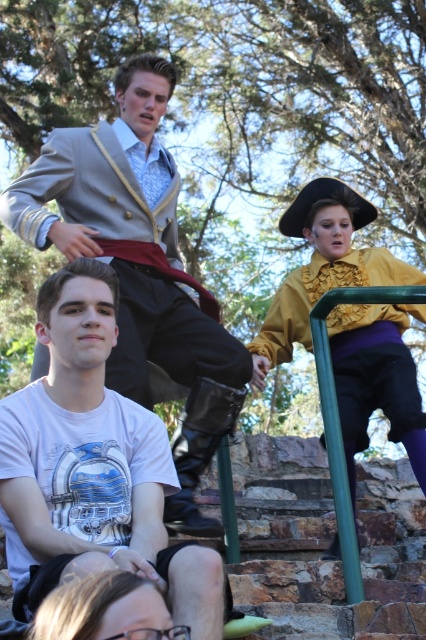
Between point (132, 97) and point (348, 243), which one is positioned behind?

The point (348, 243) is more distant.

Between matte gray suit at upper left and matte yellow blouse at upper right, which one is positioned higher?

Positioned higher is matte gray suit at upper left.

Does point (157, 193) come closer to viewer compared to point (282, 308)?

That is True.

At what (x,y) coordinates should I click in order to perform the action: click on matte gray suit at upper left. Please return your answer as a coordinate pair (x, y). Looking at the image, I should click on (140, 268).

Is point (58, 419) closer to camera compared to point (51, 157)?

That is True.

Which is more to the right, white cotton t-shirt at lower left or matte gray suit at upper left?

Positioned to the right is white cotton t-shirt at lower left.

This screenshot has height=640, width=426. Describe the element at coordinates (92, 467) in the screenshot. I see `white cotton t-shirt at lower left` at that location.

The image size is (426, 640). I want to click on white cotton t-shirt at lower left, so click(92, 467).

Can you confirm if white cotton t-shirt at lower left is shorter than matte yellow blouse at upper right?

Indeed, white cotton t-shirt at lower left has a lesser height compared to matte yellow blouse at upper right.

At what (x,y) coordinates should I click in order to perform the action: click on white cotton t-shirt at lower left. Please return your answer as a coordinate pair (x, y). Looking at the image, I should click on (92, 467).

Locate an element on the screen. The height and width of the screenshot is (640, 426). white cotton t-shirt at lower left is located at coordinates (92, 467).